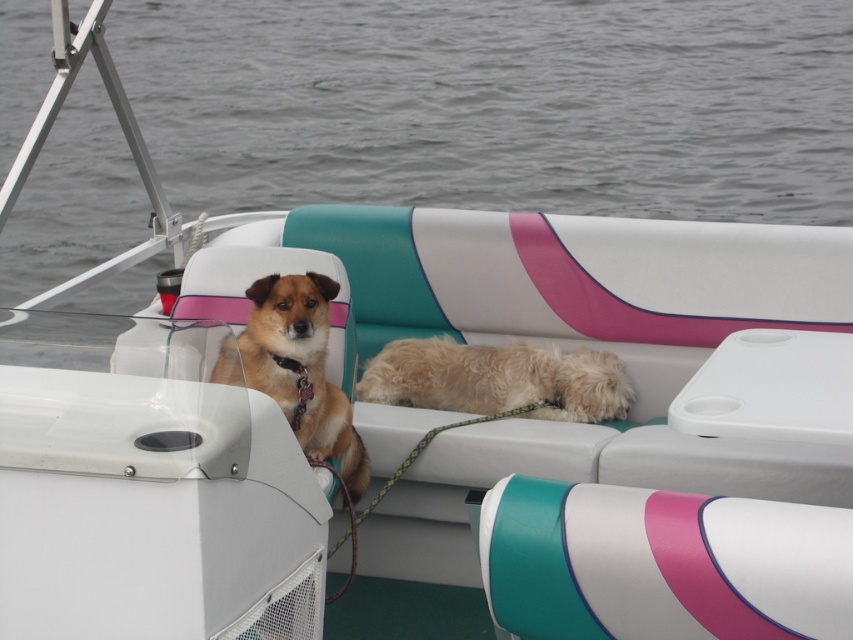
How much distance is there between fuzzy beige dog at center and brown furry dog at center?

They are 86.80 centimeters apart.

Does point (605, 394) lie in front of point (296, 394)?

No, it is behind (296, 394).

This screenshot has width=853, height=640. Identify the location of fuzzy beige dog at center. (497, 380).

At what (x,y) coordinates should I click in order to perform the action: click on fuzzy beige dog at center. Please return your answer as a coordinate pair (x, y). This screenshot has width=853, height=640. Looking at the image, I should click on (497, 380).